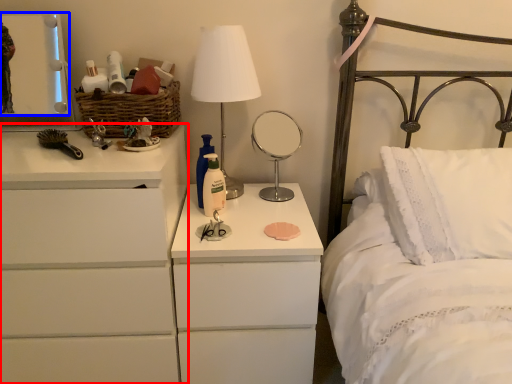
Question: Which point is further to the camera, chest of drawers (highlighted by a red box) or mirror (highlighted by a blue box)?

Choices:
 (A) chest of drawers
 (B) mirror

Answer: (B)